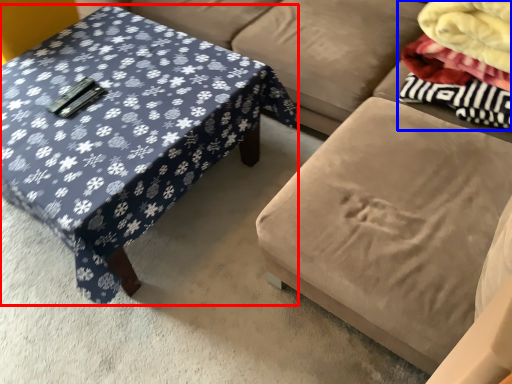
Question: Among these objects, which one is nearest to the camera, coffee table (highlighted by a red box) or fabric (highlighted by a blue box)?

Choices:
 (A) coffee table
 (B) fabric

Answer: (A)